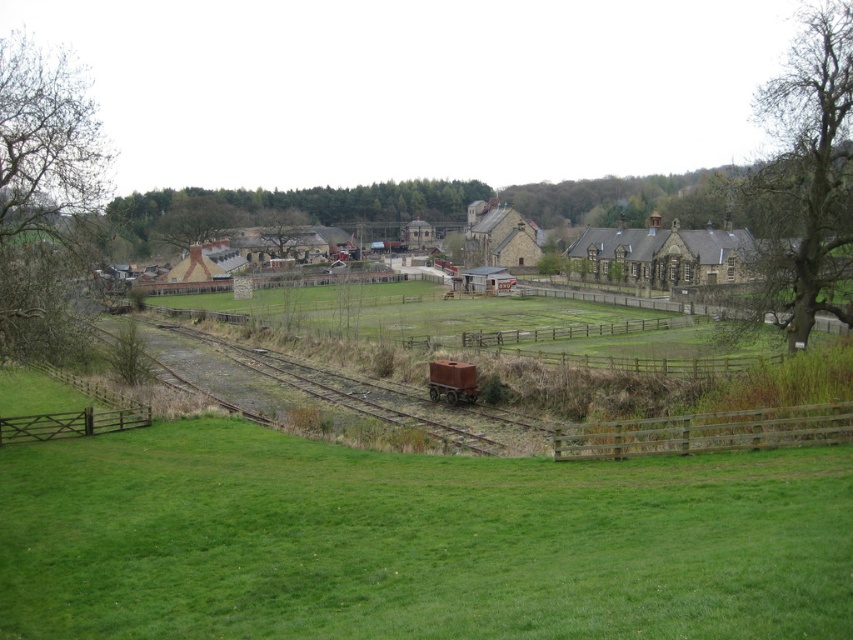
Between bare bark tree at right and green leafy tree at center, which one appears on the right side from the viewer's perspective?

bare bark tree at right is more to the right.

Which is behind, point (840, 157) or point (222, 227)?

Positioned behind is point (222, 227).

Find the location of a particular element. The width and height of the screenshot is (853, 640). bare bark tree at right is located at coordinates click(807, 173).

Does bare branches at left appear over wooden fence at lower right?

Indeed, bare branches at left is positioned over wooden fence at lower right.

Is point (6, 99) positioned before point (618, 436)?

That is False.

Locate an element on the screen. The image size is (853, 640). bare branches at left is located at coordinates (42, 193).

You are a GUI agent. You are given a task and a screenshot of the screen. Output one action in this format:
    pyautogui.click(x=<x>, y=<y>)
    Task: Click on the bare branches at left
    The height and width of the screenshot is (640, 853).
    Given the screenshot: What is the action you would take?
    pyautogui.click(x=42, y=193)

Is bare bark tree at right below bare branches at left?

No.

Is bare bark tree at right closer to the viewer compared to bare branches at left?

No, bare bark tree at right is behind bare branches at left.

This screenshot has height=640, width=853. I want to click on bare bark tree at right, so click(x=807, y=173).